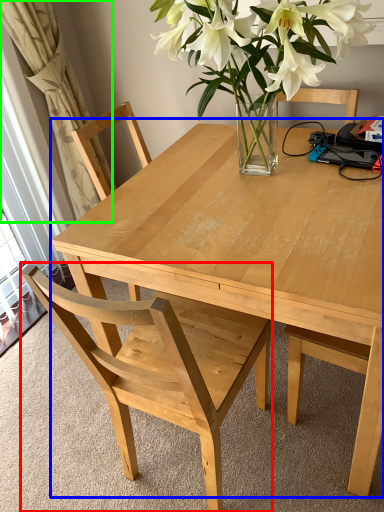
Question: Estimate the real-world distances between objects in this image. Which object is closer to chair (highlighted by a red box), kitchen & dining room table (highlighted by a blue box) or curtain (highlighted by a green box)?

Choices:
 (A) kitchen & dining room table
 (B) curtain

Answer: (A)